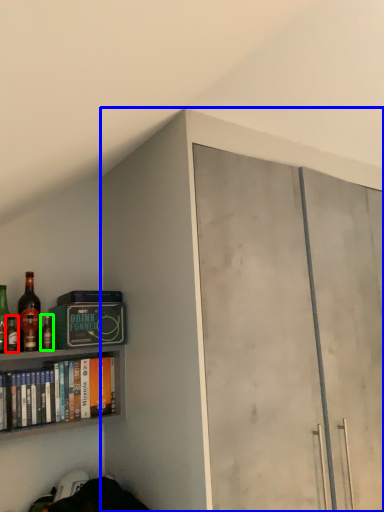
Question: Which object is the farthest from bottle (highlighted by a red box)? Choose among these: cabinetry (highlighted by a blue box) or bottle (highlighted by a green box).

Choices:
 (A) cabinetry
 (B) bottle

Answer: (A)